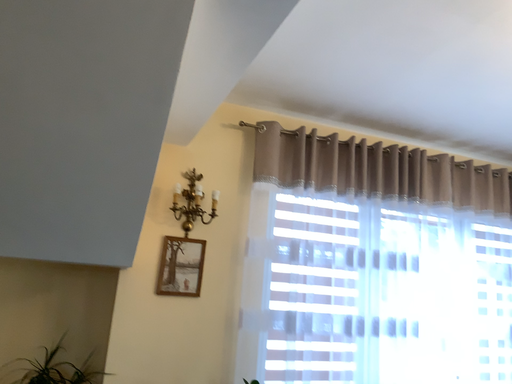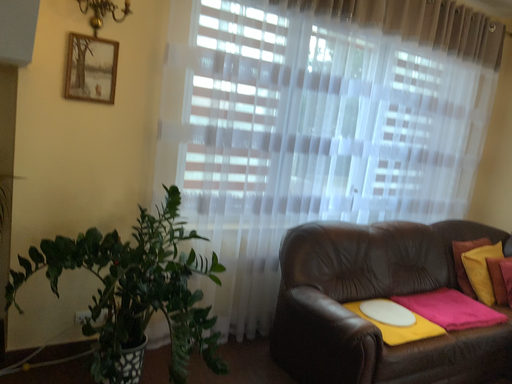
Question: How did the camera likely rotate when shooting the video?

Choices:
 (A) rotated downward
 (B) rotated upward

Answer: (A)